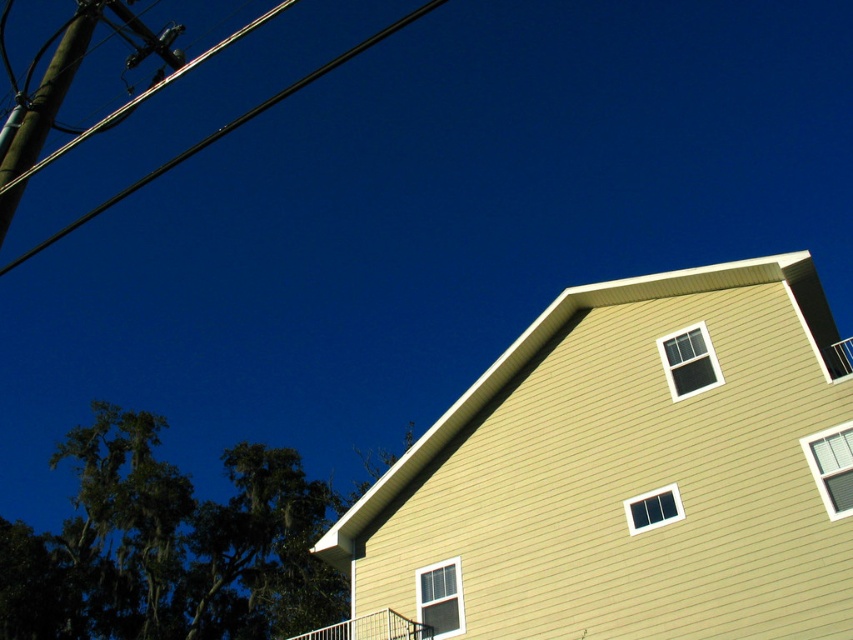
You are standing at the center of the image. Which direction should you look to see the brown wooden telegraph pole at upper left?

The brown wooden telegraph pole at upper left is located at the upper left direction from the center of the image.